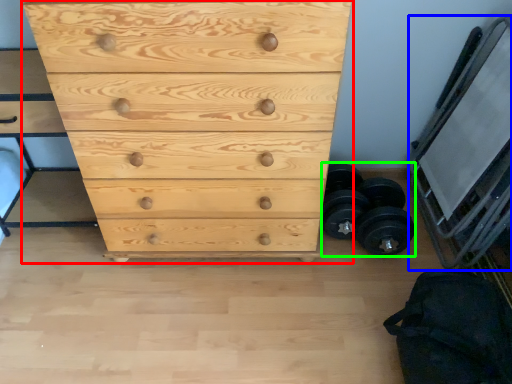
Question: Based on their relative distances, which object is nearer to chest of drawers (highlighted by a red box)? Choose from bunk bed (highlighted by a blue box) and dumbbell (highlighted by a green box).

Choices:
 (A) bunk bed
 (B) dumbbell

Answer: (B)